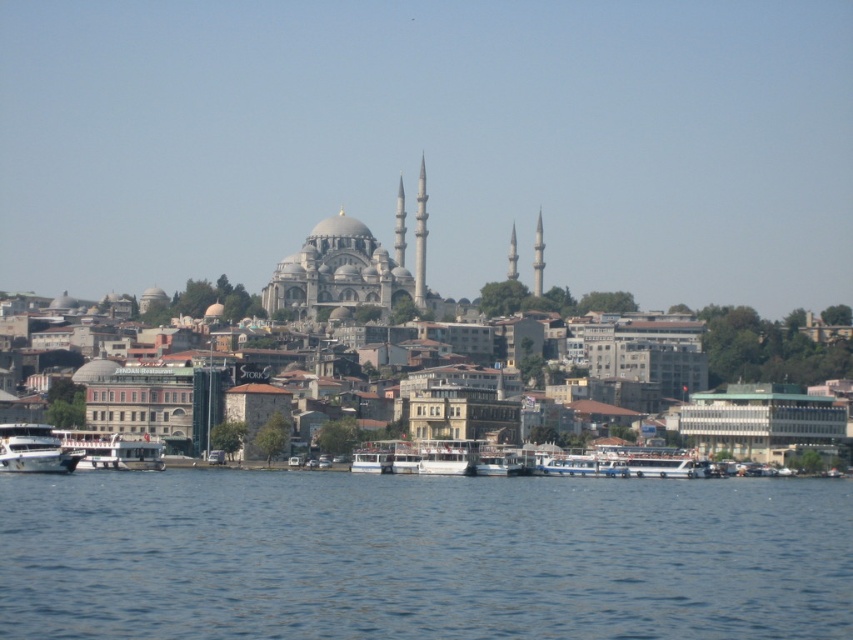
Question: Can you confirm if blue water at lower center is smaller than white matte boat at lower left?

Choices:
 (A) yes
 (B) no

Answer: (B)

Question: Which of the following is the closest to the observer?

Choices:
 (A) white glossy boat at center
 (B) white matte boat at lower left
 (C) blue water at lower center
 (D) white matte boat at lower center

Answer: (C)

Question: Considering the relative positions of blue water at lower center and white matte boat at lower left in the image provided, where is blue water at lower center located with respect to white matte boat at lower left?

Choices:
 (A) below
 (B) above

Answer: (A)

Question: Which of the following is the farthest from the observer?

Choices:
 (A) (80, 452)
 (B) (7, 440)
 (C) (621, 518)

Answer: (A)

Question: Which point is farther from the camera taking this photo?

Choices:
 (A) (260, 531)
 (B) (78, 436)
 (C) (622, 458)
 (D) (45, 465)

Answer: (C)

Question: Can you confirm if white matte boat at lower center is smaller than white matte boat at lower left?

Choices:
 (A) no
 (B) yes

Answer: (A)